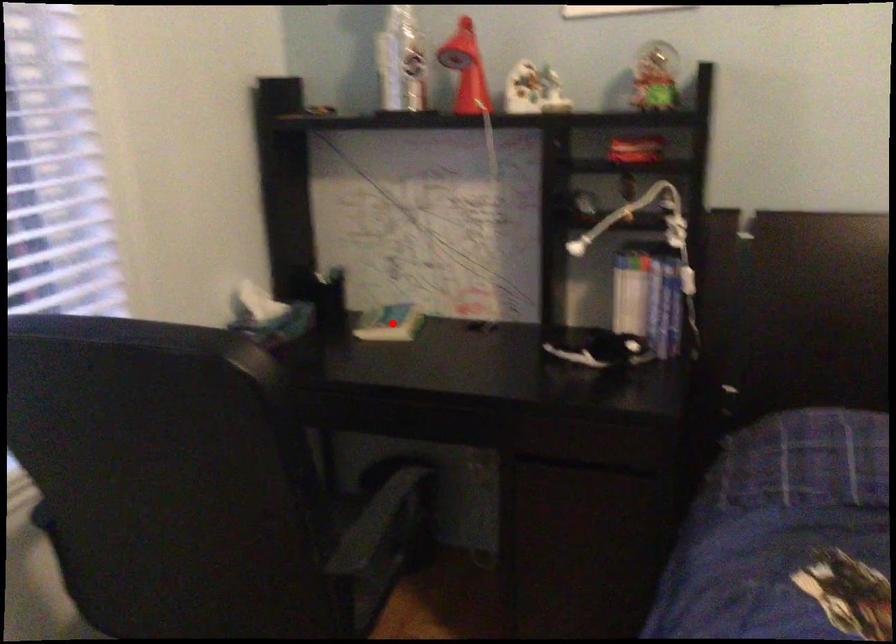
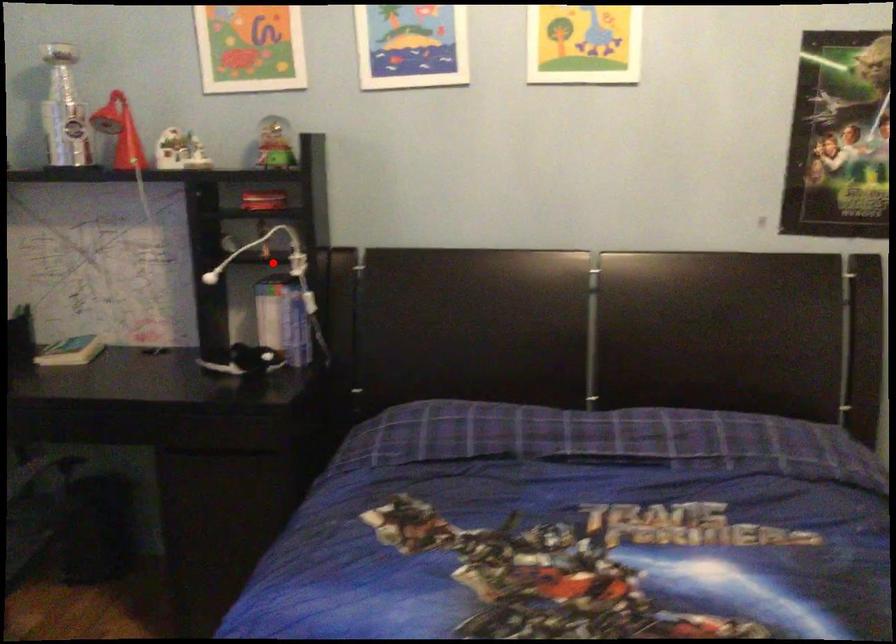
I am providing you with two images of the same scene from different viewpoints. A red point is marked on the first image and another point is marked on the second image. Is the marked point in image1 the same physical position as the marked point in image2?

No